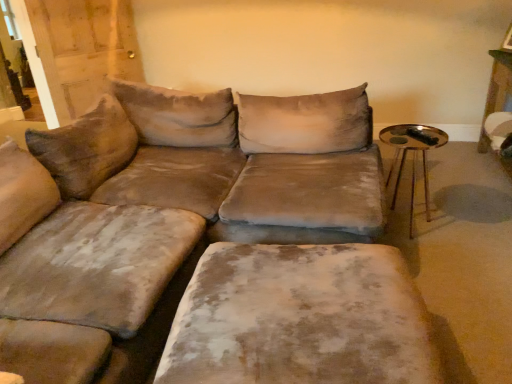
Measure the distance between gold metallic side table at right and camera.

8.53 feet.

This screenshot has width=512, height=384. Describe the element at coordinates (300, 318) in the screenshot. I see `velvet beige ottoman at center` at that location.

Find the location of a particular element. velvet beige couch at center is located at coordinates (164, 213).

Based on their sizes in the image, would you say velvet beige couch at center is bigger or smaller than gold metallic side table at right?

Considering their sizes, velvet beige couch at center takes up more space than gold metallic side table at right.

Would you say gold metallic side table at right is part of velvet beige couch at center's contents?

That's incorrect, gold metallic side table at right is not inside velvet beige couch at center.

Considering the relative sizes of velvet beige couch at center and gold metallic side table at right in the image provided, is velvet beige couch at center wider than gold metallic side table at right?

Indeed, velvet beige couch at center has a greater width compared to gold metallic side table at right.

In the scene shown: Is velvet beige couch at center aimed at gold metallic side table at right?

Yes, velvet beige couch at center is facing gold metallic side table at right.

From a real-world perspective, is velvet beige couch at center physically below velvet beige ottoman at center?

No, from a real-world perspective, velvet beige couch at center is not below velvet beige ottoman at center.

Between velvet beige couch at center and velvet beige ottoman at center, which one has larger width?

velvet beige couch at center is wider.

Which is behind, point (48, 377) or point (332, 306)?

The point (332, 306) is behind.

At what (x,y) coordinates should I click in order to perform the action: click on wide in front of the gold metallic side table at right. Please return your answer as a coordinate pair (x, y). This screenshot has height=384, width=512. Looking at the image, I should click on (300, 318).

Looking at this image, in terms of size, does gold metallic side table at right appear bigger or smaller than velvet beige ottoman at center?

In the image, gold metallic side table at right appears to be smaller than velvet beige ottoman at center.

From their relative heights in the image, would you say gold metallic side table at right is taller or shorter than velvet beige ottoman at center?

Clearly, gold metallic side table at right is taller compared to velvet beige ottoman at center.

From the image's perspective, between gold metallic side table at right and velvet beige ottoman at center, who is located below?

velvet beige ottoman at center, from the image's perspective.

Does velvet beige ottoman at center have a larger size compared to velvet beige couch at center?

No, velvet beige ottoman at center is not bigger than velvet beige couch at center.

Considering the points (309, 321) and (109, 383), which point is behind, point (309, 321) or point (109, 383)?

The point (109, 383) is behind.

From a real-world perspective, which object rests below the other?

In real-world perspective, velvet beige ottoman at center is lower.

Can you confirm if velvet beige ottoman at center is wider than velvet beige couch at center?

In fact, velvet beige ottoman at center might be narrower than velvet beige couch at center.

Based on their positions, is velvet beige ottoman at center located to the left or right of gold metallic side table at right?

velvet beige ottoman at center is positioned on gold metallic side table at right's left side.

From the image's perspective, who appears lower, velvet beige ottoman at center or gold metallic side table at right?

velvet beige ottoman at center is shown below in the image.

From a real-world perspective, is velvet beige ottoman at center physically located above or below gold metallic side table at right?

Clearly, from a real-world perspective, velvet beige ottoman at center is below gold metallic side table at right.

Is velvet beige ottoman at center taller than gold metallic side table at right?

No.

Considering the relative sizes of gold metallic side table at right and velvet beige couch at center in the image provided, is gold metallic side table at right smaller than velvet beige couch at center?

Yes.

Is gold metallic side table at right beside velvet beige couch at center?

No, gold metallic side table at right is not in contact with velvet beige couch at center.

Which is closer, (436, 131) or (205, 138)?

The point (205, 138) is more forward.

From a real-world perspective, which object rests below the other?

gold metallic side table at right.

This screenshot has width=512, height=384. I want to click on side table lying behind the velvet beige couch at center, so click(x=413, y=158).

You are a GUI agent. You are given a task and a screenshot of the screen. Output one action in this format:
    pyautogui.click(x=<x>, y=<y>)
    Task: Click on the studio couch that is in front of the velvet beige ottoman at center
    The width and height of the screenshot is (512, 384).
    Given the screenshot: What is the action you would take?
    pyautogui.click(x=164, y=213)

Considering their positions, is gold metallic side table at right positioned closer to velvet beige ottoman at center than velvet beige couch at center?

Based on the image, velvet beige couch at center appears to be nearer to velvet beige ottoman at center.

Based on the photo, looking at the image, which one is located closer to velvet beige ottoman at center, velvet beige couch at center or gold metallic side table at right?

velvet beige couch at center is closer to velvet beige ottoman at center.

When comparing their distances from velvet beige couch at center, does gold metallic side table at right or velvet beige ottoman at center seem closer?

velvet beige ottoman at center is closer to velvet beige couch at center.

Looking at the image, which one is located closer to gold metallic side table at right, velvet beige ottoman at center or velvet beige couch at center?

velvet beige couch at center is closer to gold metallic side table at right.

Looking at the image, which one is located further to velvet beige couch at center, velvet beige ottoman at center or gold metallic side table at right?

Among the two, gold metallic side table at right is located further to velvet beige couch at center.

Based on their spatial positions, is velvet beige couch at center or velvet beige ottoman at center closer to gold metallic side table at right?

Based on the image, velvet beige couch at center appears to be nearer to gold metallic side table at right.

Where is `wide between velvet beige couch at center and gold metallic side table at right in the front-back direction`? The image size is (512, 384). wide between velvet beige couch at center and gold metallic side table at right in the front-back direction is located at coordinates (300, 318).